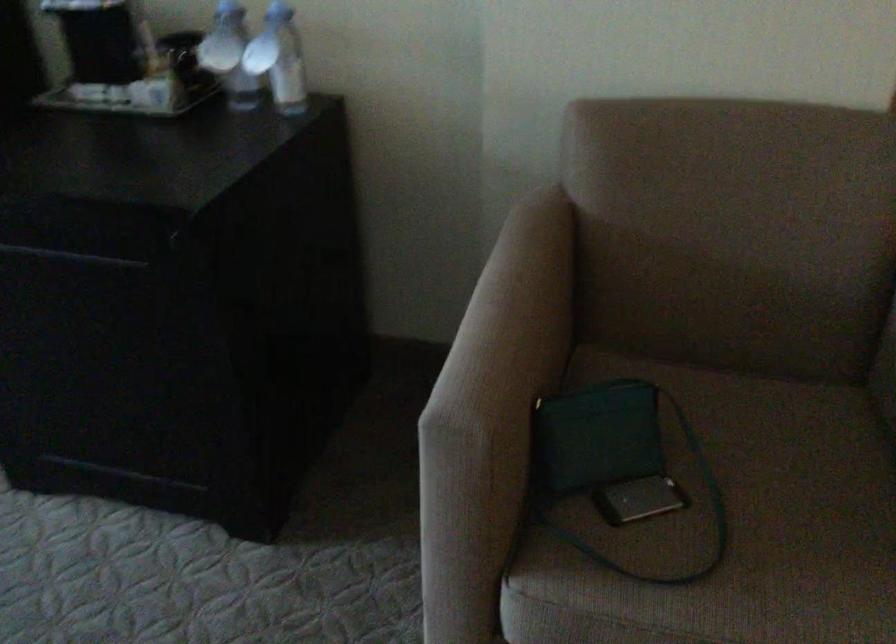
The height and width of the screenshot is (644, 896). Describe the element at coordinates (639, 500) in the screenshot. I see `a smartphone` at that location.